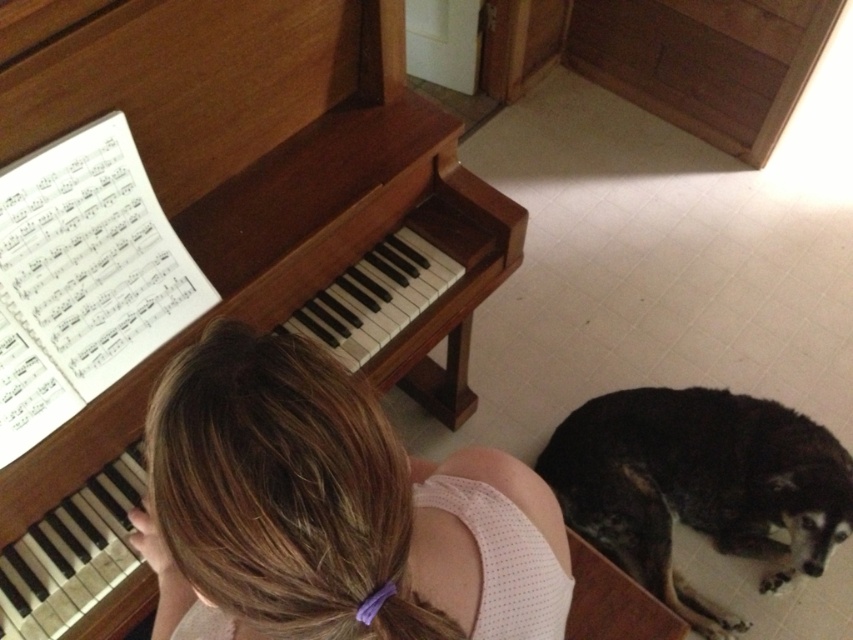
Question: In this image, where is wooden piano at left located relative to brown hair at upper center?

Choices:
 (A) left
 (B) right

Answer: (A)

Question: Which object is positioned closest to the wooden piano at left?

Choices:
 (A) black fur dog at lower right
 (B) brown hair at upper center

Answer: (B)

Question: Which of the following is the closest to the observer?

Choices:
 (A) black fur dog at lower right
 (B) wooden piano at left

Answer: (B)

Question: Can you confirm if wooden piano at left is wider than black fur dog at lower right?

Choices:
 (A) yes
 (B) no

Answer: (A)

Question: Which point is closer to the camera?

Choices:
 (A) (656, 488)
 (B) (67, 68)

Answer: (B)

Question: Is wooden piano at left to the left of brown hair at upper center from the viewer's perspective?

Choices:
 (A) no
 (B) yes

Answer: (B)